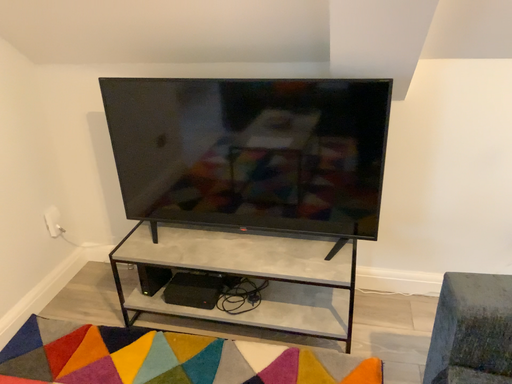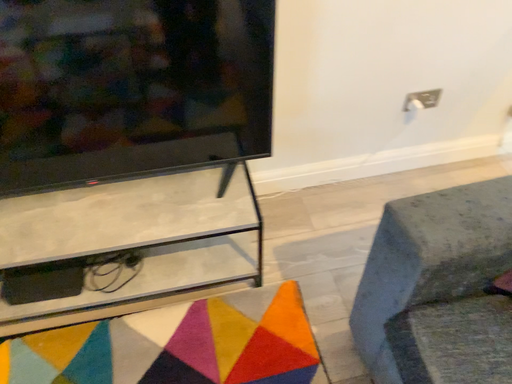
Question: How did the camera likely rotate when shooting the video?

Choices:
 (A) rotated right
 (B) rotated left

Answer: (A)